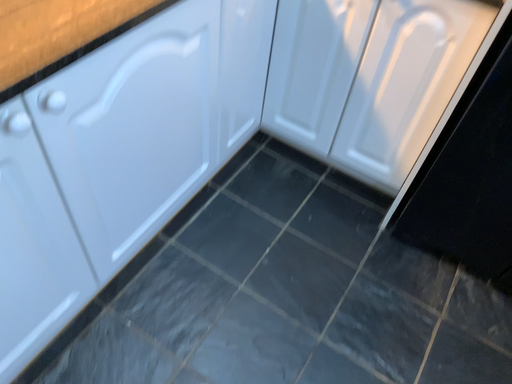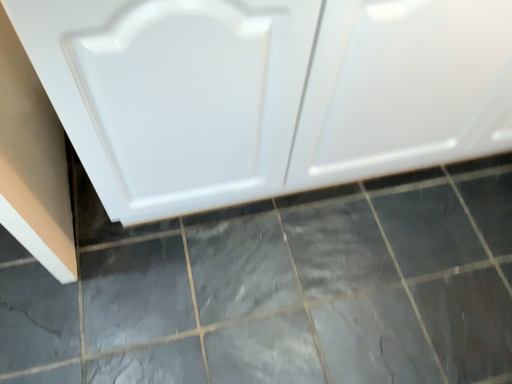
Question: How did the camera likely rotate when shooting the video?

Choices:
 (A) rotated left
 (B) rotated right

Answer: (A)